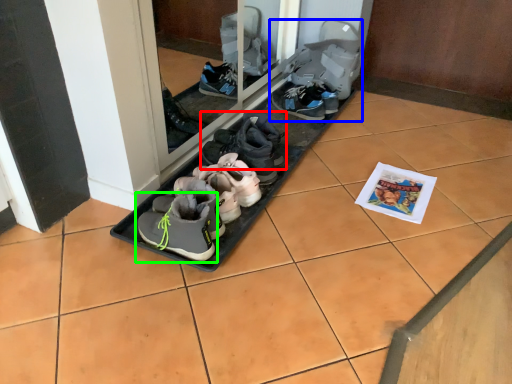
Question: Based on their relative distances, which object is nearer to footwear (highlighted by a red box)? Choose from footwear (highlighted by a blue box) and footwear (highlighted by a green box).

Choices:
 (A) footwear
 (B) footwear

Answer: (B)